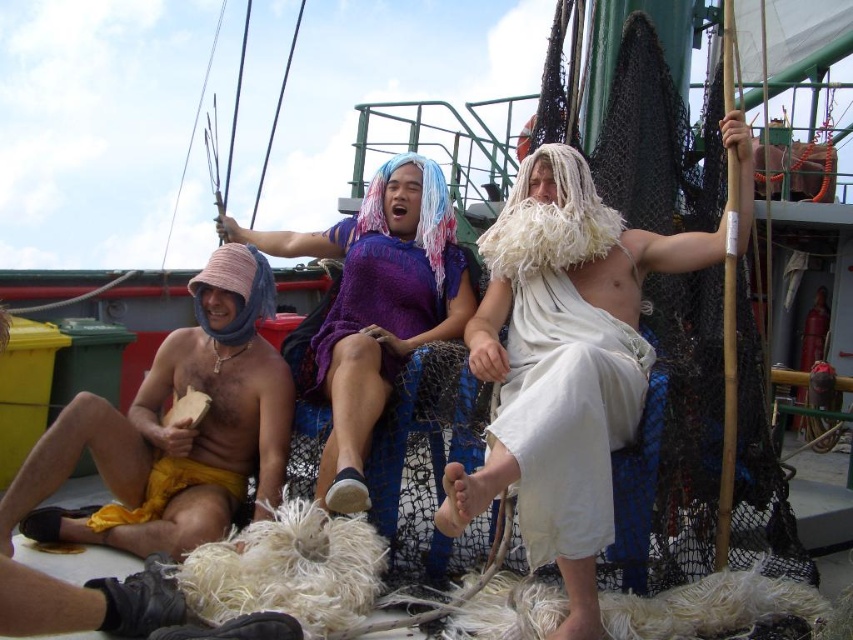
You are standing on the deck of the fishing vessel and want to greet the white clothed man at center and the purple knitted robe at center. Which person should you approach first if you want to greet the one closer to you?

You should first greet the white clothed man at center because he is in front of the purple knitted robe at center, meaning he is closer to you.

What object is located at the coordinate point (173, 429) on the deck of the fishing vessel?

The point at (173, 429) on the deck of the fishing vessel indicates the location of the matte yellow shorts at left.

You are standing on the deck of the fishing vessel and want to pick up an item located at point A and another item at point B. If point A is at coordinates point(230, 368) and point B is at point(315, 364), which point is closer to you?

Point A at coordinates point(230, 368) is closer to you because it is further to the camera than point B at point(315, 364).